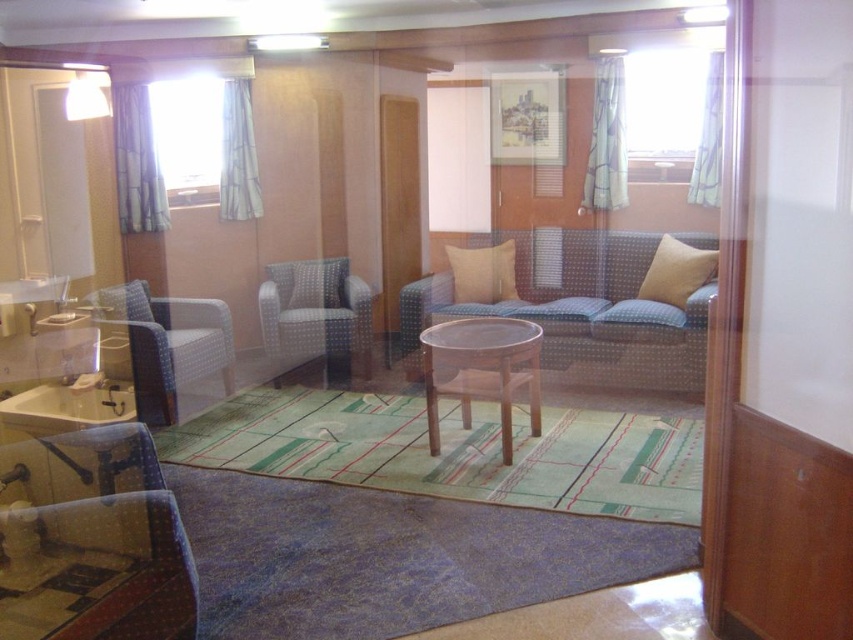
Does brown wooden table at center have a lesser width compared to beige fabric pillow at right?

In fact, brown wooden table at center might be wider than beige fabric pillow at right.

At what (x,y) coordinates should I click in order to perform the action: click on brown wooden table at center. Please return your answer as a coordinate pair (x, y). The width and height of the screenshot is (853, 640). Looking at the image, I should click on (480, 371).

Which is below, matte blue armchair at left or matte blue armchair at center?

matte blue armchair at left is below.

Is the position of matte blue armchair at left more distant than that of matte blue armchair at center?

No, it is in front of matte blue armchair at center.

Is point (169, 417) farther from camera compared to point (274, 289)?

No, (169, 417) is closer to viewer.

Identify the location of matte blue armchair at left. (167, 344).

Who is more forward, [550,272] or [177,323]?

Point [177,323] is more forward.

Is point (634, 388) positioned after point (137, 364)?

That is True.

Where is `blue dotted fabric couch at center`? The height and width of the screenshot is (640, 853). blue dotted fabric couch at center is located at coordinates (579, 310).